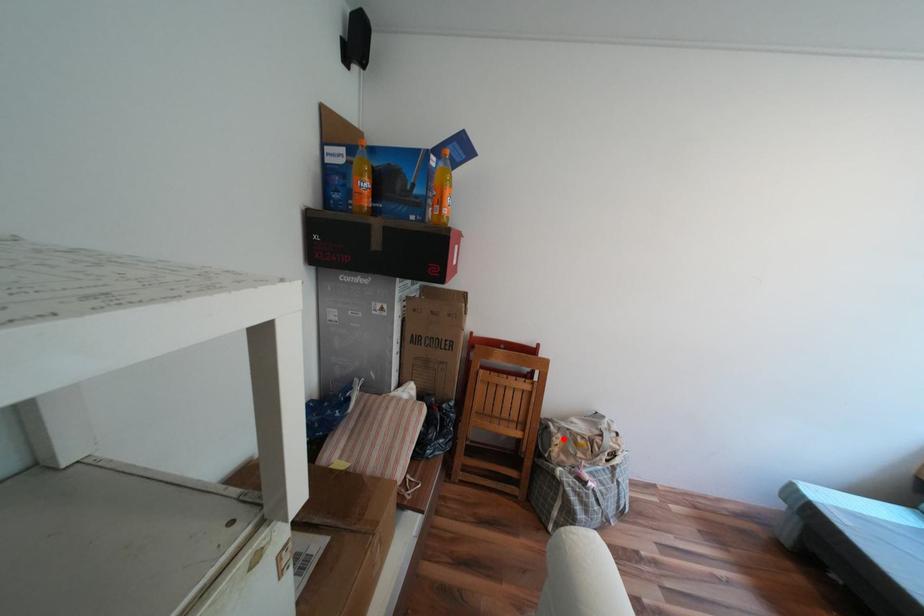
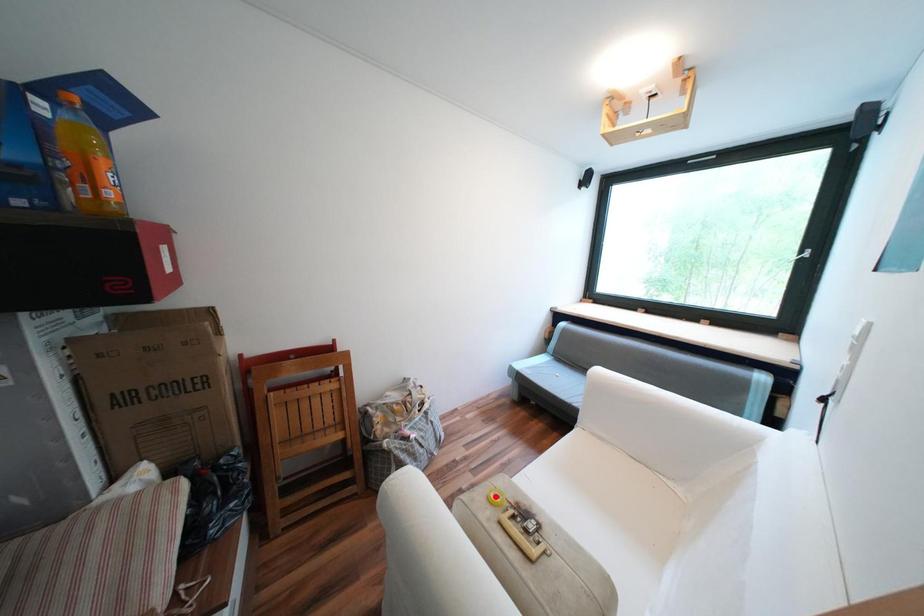
I am providing you with two images of the same scene from different viewpoints. A red point is marked on the first image and another point is marked on the second image. Does the point marked in image1 correspond to the same location as the one in image2?

No